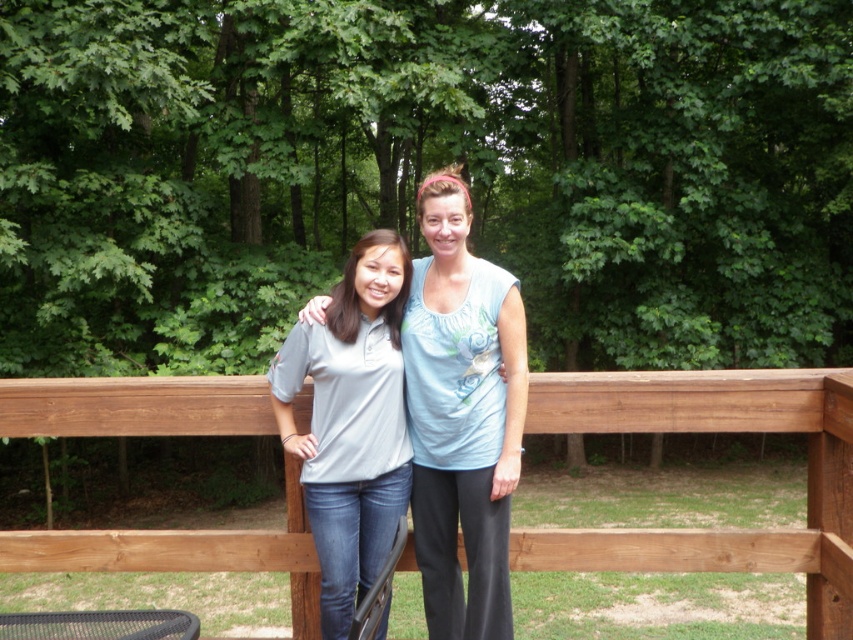
Who is positioned more to the left, brown wooden fence at center or matte gray shirt at center?

From the viewer's perspective, matte gray shirt at center appears more on the left side.

Can you confirm if brown wooden fence at center is taller than matte gray shirt at center?

No.

Who is more forward, (548,385) or (351,474)?

Point (351,474) is more forward.

Where is `brown wooden fence at center`? The image size is (853, 640). brown wooden fence at center is located at coordinates (712, 432).

Does light blue cotton shirt at center come behind matte gray shirt at center?

Yes, light blue cotton shirt at center is further from the viewer.

Can you confirm if light blue cotton shirt at center is thinner than matte gray shirt at center?

Yes, light blue cotton shirt at center is thinner than matte gray shirt at center.

You are a GUI agent. You are given a task and a screenshot of the screen. Output one action in this format:
    pyautogui.click(x=<x>, y=<y>)
    Task: Click on the light blue cotton shirt at center
    This screenshot has width=853, height=640.
    Given the screenshot: What is the action you would take?
    pyautogui.click(x=462, y=417)

Does brown wooden fence at center have a lesser width compared to light blue cotton shirt at center?

No, brown wooden fence at center is not thinner than light blue cotton shirt at center.

Does point (653, 547) come farther from viewer compared to point (448, 428)?

That is True.

Does point (811, 440) come farther from viewer compared to point (491, 413)?

Yes, point (811, 440) is farther from viewer.

You are a GUI agent. You are given a task and a screenshot of the screen. Output one action in this format:
    pyautogui.click(x=<x>, y=<y>)
    Task: Click on the brown wooden fence at center
    This screenshot has width=853, height=640.
    Given the screenshot: What is the action you would take?
    pyautogui.click(x=712, y=432)